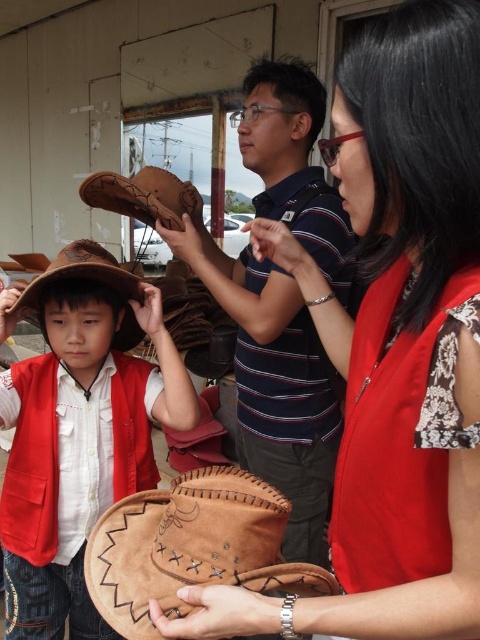
You are a delivery person who needs to place a small package on the suede cowboy hat at center. Can you confirm if the hat is positioned at the coordinates mentioned in the scene description?

The suede cowboy hat at center is positioned at point (78,432), so yes, the hat is at the coordinates mentioned in the scene description.

You are standing at the origin point of the image. The suede cowboy hat at center is located at coordinate point (78,432). If you want to move towards the suede cowboy hat at center, which direction should you move in terms of x and y coordinates?

To move towards the suede cowboy hat at center located at coordinate point (78,432) from the origin, you should move in the positive x and negative y direction since the x coordinate is greater than 0.5 and the y coordinate is less than 0.5.